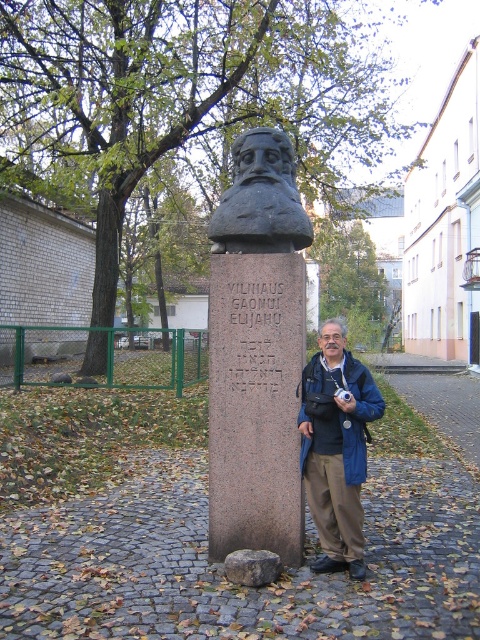
You are a photographer aiming to capture the statue and the person standing beside it. You want to ensure that the granite bust at center is visible above the blue fabric jacket at center in your photo. Based on their positions, is this possible?

Yes, because the granite bust at center is located above the blue fabric jacket at center, so positioning the camera to capture both from a lower angle would ensure the bust appears above the jacket in the photograph.